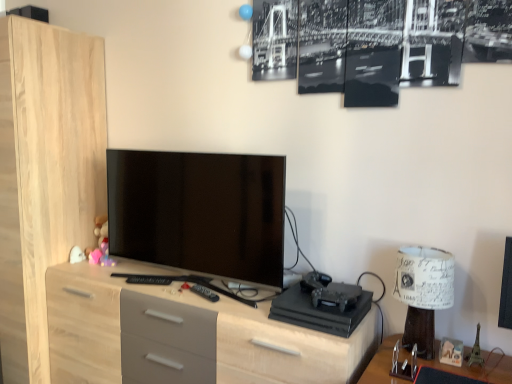
Question: Do you think light wood/grey drawers at center is within white paper lampshade at right, or outside of it?

Choices:
 (A) outside
 (B) inside

Answer: (A)

Question: Visually, is light wood/grey drawers at center positioned to the left or to the right of white paper lampshade at right?

Choices:
 (A) left
 (B) right

Answer: (A)

Question: Which object is positioned farthest from the white paper lampshade at right?

Choices:
 (A) light wood/grey drawers at center
 (B) matte black tv at center

Answer: (B)

Question: Based on their relative distances, which object is nearer to the white paper lampshade at right?

Choices:
 (A) light wood/grey drawers at center
 (B) matte black tv at center

Answer: (A)